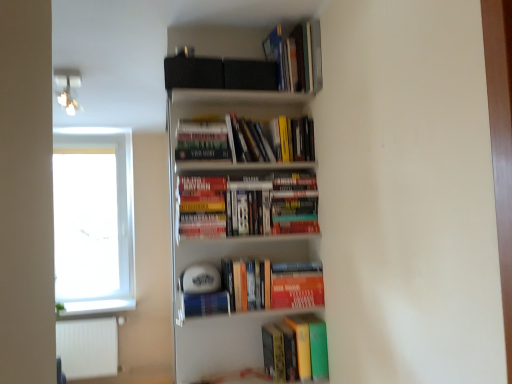
Question: Considering the positions of orange matte paperback book at center and white glossy bookshelf at upper center in the image, is orange matte paperback book at center wider or thinner than white glossy bookshelf at upper center?

Choices:
 (A) thin
 (B) wide

Answer: (A)

Question: Is orange matte paperback book at center situated inside white glossy bookshelf at upper center or outside?

Choices:
 (A) inside
 (B) outside

Answer: (A)

Question: Considering the real-world distances, which object is closest to the green matte book at lower right, which is the first book from bottom to top?

Choices:
 (A) white glossy bookshelf at upper center
 (B) white glass window at left
 (C) orange matte paperback book at center
 (D) hardcover books at center, the third book viewed from the top
 (E) hardcover books at upper center, arranged as the 2th book when viewed from the top

Answer: (C)

Question: Which object is positioned closest to the white matte radiator at lower left?

Choices:
 (A) hardcover books at center, the third book viewed from the top
 (B) hardcover books at upper center, which ranks as the 3th book in bottom-to-top order
 (C) hardcover books at upper center, the first book when ordered from top to bottom
 (D) white glass window at left
 (E) green matte book at lower right, which is the first book from bottom to top

Answer: (D)